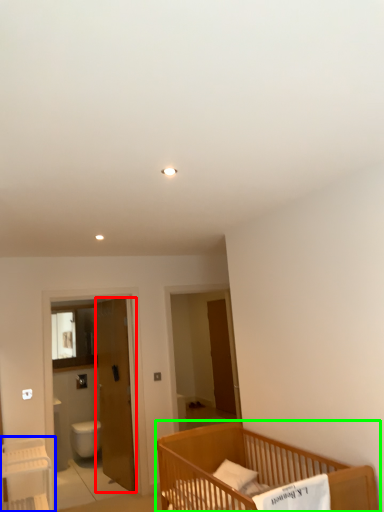
Question: Estimate the real-world distances between objects in this image. Which object is closer to door (highlighted by a red box), table (highlighted by a blue box) or infant bed (highlighted by a green box)?

Choices:
 (A) table
 (B) infant bed

Answer: (A)